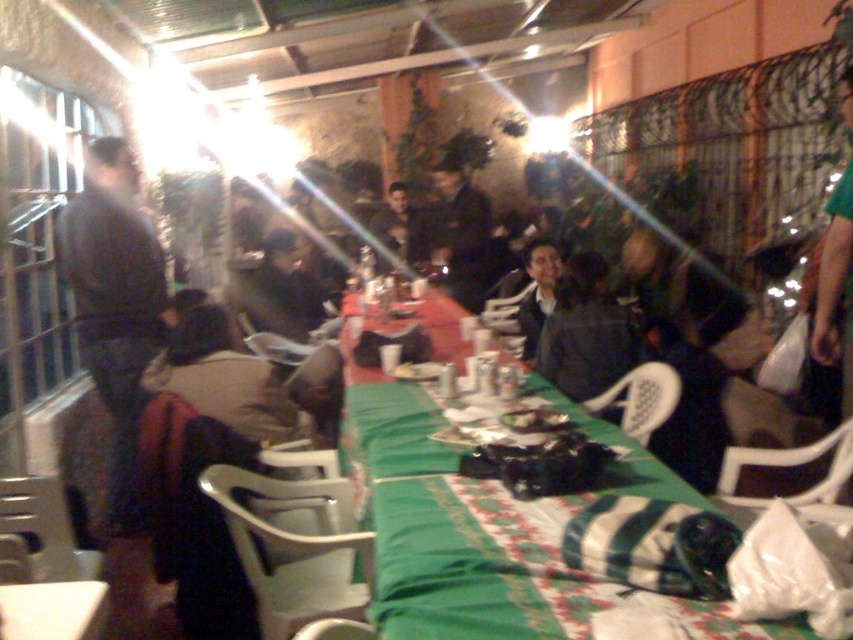
Which of these two, green fabric table at center or dark blue jacket at center, stands shorter?

green fabric table at center

Is point (402, 536) in front of point (456, 268)?

That is True.

Image resolution: width=853 pixels, height=640 pixels. I want to click on green fabric table at center, so click(x=451, y=532).

Which is more to the right, dark brown leather jacket at center or dark blue jacket at center?

From the viewer's perspective, dark blue jacket at center appears more on the right side.

The width and height of the screenshot is (853, 640). Describe the element at coordinates (222, 378) in the screenshot. I see `dark brown leather jacket at center` at that location.

Where is `dark brown leather jacket at center`? Image resolution: width=853 pixels, height=640 pixels. dark brown leather jacket at center is located at coordinates (222, 378).

Does dark brown leather jacket at center appear on the left side of green fabric table at lower left?

Correct, you'll find dark brown leather jacket at center to the left of green fabric table at lower left.

Who is shorter, dark brown leather jacket at center or green fabric table at lower left?

green fabric table at lower left

The width and height of the screenshot is (853, 640). I want to click on dark brown leather jacket at center, so click(x=222, y=378).